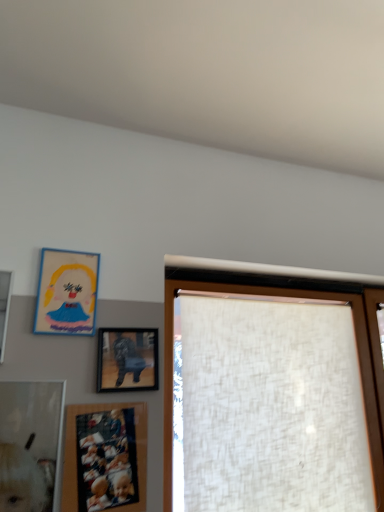
Question: Is matte wooden picture frame at upper left, arranged as the 1th picture frame when viewed from the left, facing away from matte cardboard picture frame at upper left, the second picture frame viewed from the left?

Choices:
 (A) no
 (B) yes

Answer: (A)

Question: Is matte wooden picture frame at upper left, arranged as the fourth picture frame when viewed from the right, thinner than matte cardboard picture frame at upper left, the second picture frame viewed from the left?

Choices:
 (A) yes
 (B) no

Answer: (B)

Question: Would you say matte cardboard picture frame at upper left, which appears as the third picture frame when viewed from the right, is part of matte wooden picture frame at upper left, arranged as the 1th picture frame when viewed from the left,'s contents?

Choices:
 (A) no
 (B) yes

Answer: (A)

Question: From the image's perspective, is matte wooden picture frame at upper left, arranged as the fourth picture frame when viewed from the right, on matte cardboard picture frame at upper left, which appears as the third picture frame when viewed from the right?

Choices:
 (A) no
 (B) yes

Answer: (A)

Question: Is matte wooden picture frame at upper left, arranged as the 1th picture frame when viewed from the left, at the left side of matte cardboard picture frame at upper left, which appears as the third picture frame when viewed from the right?

Choices:
 (A) yes
 (B) no

Answer: (A)

Question: Is matte wooden picture frame at upper left, arranged as the fourth picture frame when viewed from the right, not close to matte cardboard picture frame at upper left, which appears as the third picture frame when viewed from the right?

Choices:
 (A) yes
 (B) no

Answer: (B)

Question: From a real-world perspective, does matte wooden picture frame at upper left, arranged as the 1th picture frame when viewed from the left, stand above matte wooden picture frame at lower left, the 3th picture frame positioned from the left?

Choices:
 (A) no
 (B) yes

Answer: (B)

Question: From the image's perspective, does matte wooden picture frame at upper left, arranged as the 1th picture frame when viewed from the left, appear lower than matte wooden picture frame at lower left, placed as the 2th picture frame when sorted from right to left?

Choices:
 (A) no
 (B) yes

Answer: (A)

Question: Does matte wooden picture frame at upper left, arranged as the 1th picture frame when viewed from the left, have a lesser width compared to matte wooden picture frame at lower left, the 3th picture frame positioned from the left?

Choices:
 (A) no
 (B) yes

Answer: (A)

Question: Are matte wooden picture frame at upper left, arranged as the 1th picture frame when viewed from the left, and matte wooden picture frame at lower left, placed as the 2th picture frame when sorted from right to left, located far from each other?

Choices:
 (A) no
 (B) yes

Answer: (A)

Question: Considering the relative positions of matte wooden picture frame at upper left, arranged as the 1th picture frame when viewed from the left, and matte wooden picture frame at lower left, the 3th picture frame positioned from the left, in the image provided, is matte wooden picture frame at upper left, arranged as the 1th picture frame when viewed from the left, behind matte wooden picture frame at lower left, the 3th picture frame positioned from the left,?

Choices:
 (A) no
 (B) yes

Answer: (A)

Question: Does matte wooden picture frame at upper left, arranged as the fourth picture frame when viewed from the right, lie in front of matte wooden picture frame at lower left, the 3th picture frame positioned from the left?

Choices:
 (A) no
 (B) yes

Answer: (B)

Question: Is matte cardboard picture frame at upper left, which appears as the third picture frame when viewed from the right, not near matte wooden picture frame at lower left, the 3th picture frame positioned from the left?

Choices:
 (A) no
 (B) yes

Answer: (A)